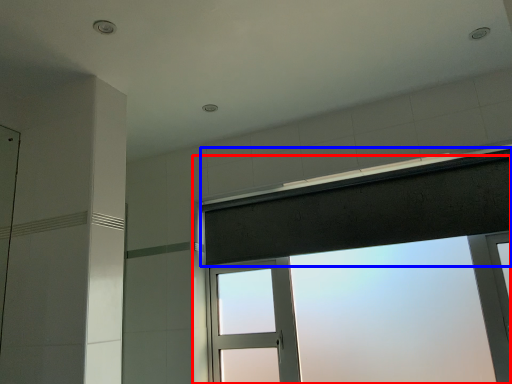
Question: Which object is closer to the camera taking this photo, window (highlighted by a red box) or shower curtain (highlighted by a blue box)?

Choices:
 (A) window
 (B) shower curtain

Answer: (A)